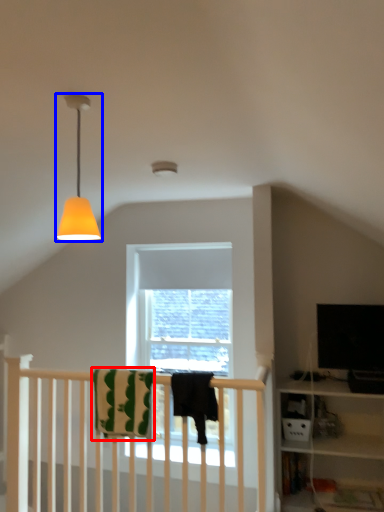
Question: Which of the following is the farthest to the observer, beach towel (highlighted by a red box) or lamp (highlighted by a blue box)?

Choices:
 (A) beach towel
 (B) lamp

Answer: (A)